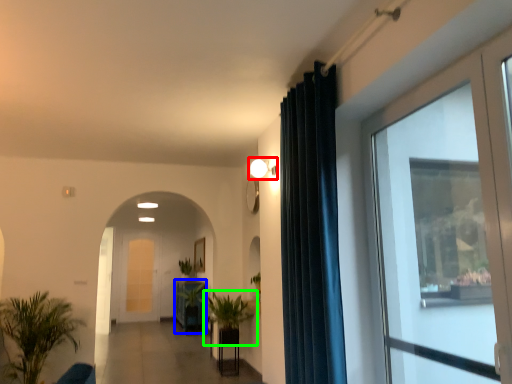
Question: Based on their relative distances, which object is farther from light fixture (highlighted by a red box)? Choose from furniture (highlighted by a blue box) and houseplant (highlighted by a green box).

Choices:
 (A) furniture
 (B) houseplant

Answer: (A)